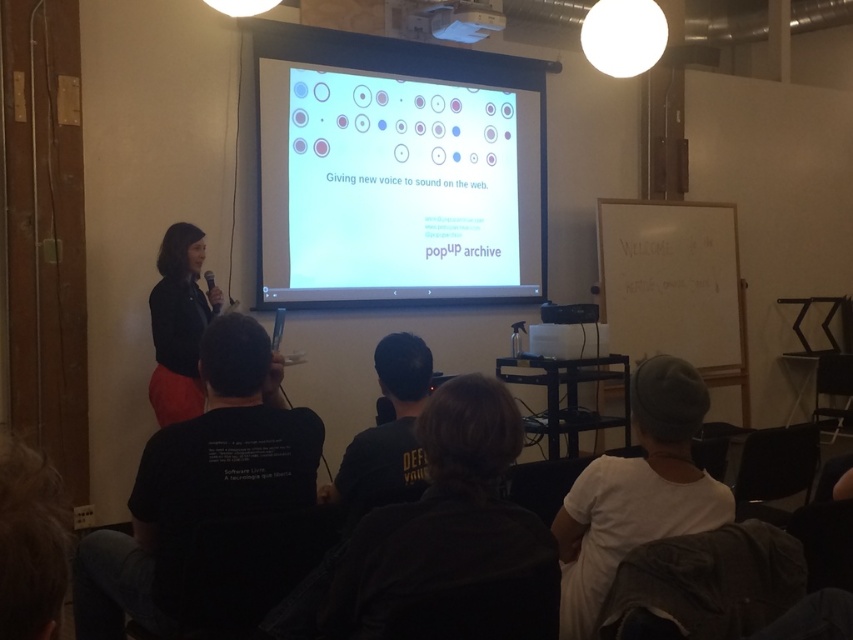
Is point (679, 520) positioned after point (471, 22)?

No, (679, 520) is closer to viewer.

Does white cotton shirt at lower right appear under white plastic projector at upper center?

Yes, white cotton shirt at lower right is below white plastic projector at upper center.

Is point (691, 468) positioned before point (480, 13)?

Yes, it is.

Find the location of a particular element. Image resolution: width=853 pixels, height=640 pixels. white cotton shirt at lower right is located at coordinates (636, 492).

Describe the element at coordinates (178, 324) in the screenshot. The image size is (853, 640). I see `matte black jacket at left` at that location.

Who is lower down, matte black jacket at left or white plastic projector at upper center?

matte black jacket at left is below.

Is point (196, 324) positioned in front of point (425, 36)?

Yes.

The width and height of the screenshot is (853, 640). Identify the location of matte black jacket at left. (178, 324).

Which of these two, black cotton t-shirt at lower left or matte black jacket at left, stands shorter?

Standing shorter between the two is black cotton t-shirt at lower left.

Is black cotton t-shirt at lower left to the left of matte black jacket at left from the viewer's perspective?

Incorrect, black cotton t-shirt at lower left is not on the left side of matte black jacket at left.

The height and width of the screenshot is (640, 853). What do you see at coordinates (199, 483) in the screenshot? I see `black cotton t-shirt at lower left` at bounding box center [199, 483].

The image size is (853, 640). Identify the location of black cotton t-shirt at lower left. (199, 483).